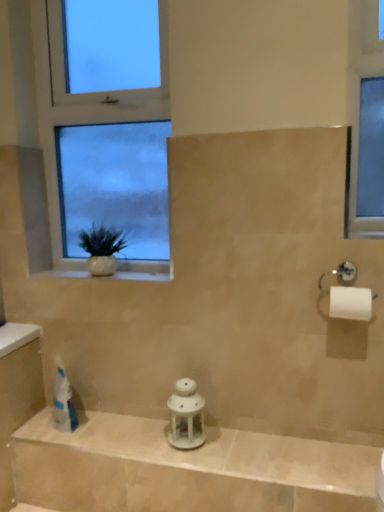
You are a GUI agent. You are given a task and a screenshot of the screen. Output one action in this format:
    pyautogui.click(x=<x>, y=<y>)
    Task: Click on the blank space to the left of white porcelain lantern at center
    This screenshot has width=384, height=512.
    Given the screenshot: What is the action you would take?
    pyautogui.click(x=142, y=436)